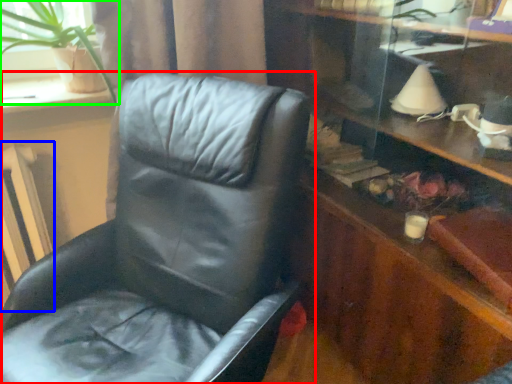
Question: Which is farther away from chair (highlighted by a red box)? radiator (highlighted by a blue box) or houseplant (highlighted by a green box)?

Choices:
 (A) radiator
 (B) houseplant

Answer: (A)